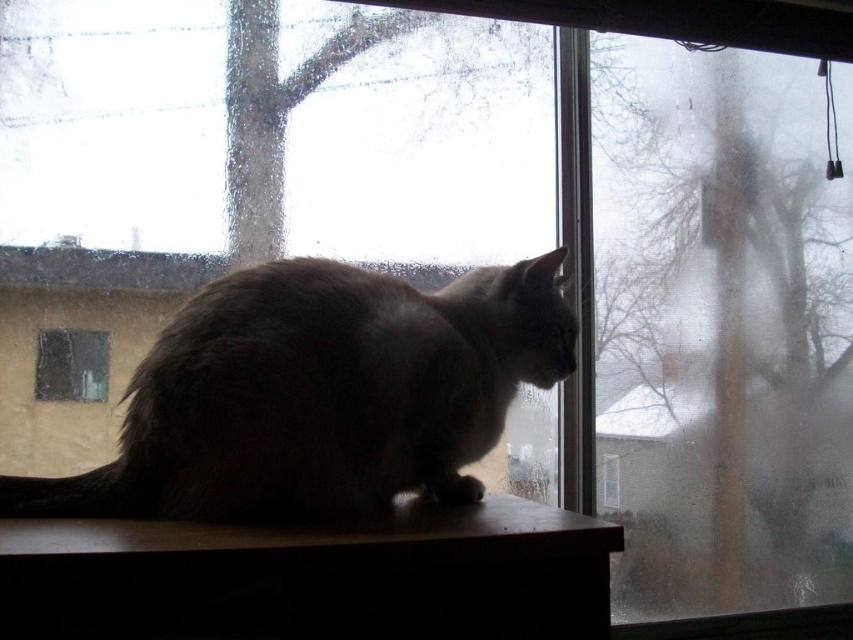
The image size is (853, 640). What do you see at coordinates (312, 577) in the screenshot? I see `brown wood at lower center` at bounding box center [312, 577].

What are the coordinates of `brown wood at lower center` in the screenshot? It's located at (312, 577).

Find the location of a particular element. This screenshot has width=853, height=640. brown wood at lower center is located at coordinates (312, 577).

Between brown wood at lower center and clear glass window at center, which one has more height?

brown wood at lower center is taller.

Identify the location of brown wood at lower center. The width and height of the screenshot is (853, 640). (312, 577).

Who is lower down, gray fur cat at center or clear glass window at center?

Positioned lower is gray fur cat at center.

Between point (231, 369) and point (99, 356), which one is positioned behind?

The point (99, 356) is more distant.

The width and height of the screenshot is (853, 640). I want to click on gray fur cat at center, so click(x=320, y=394).